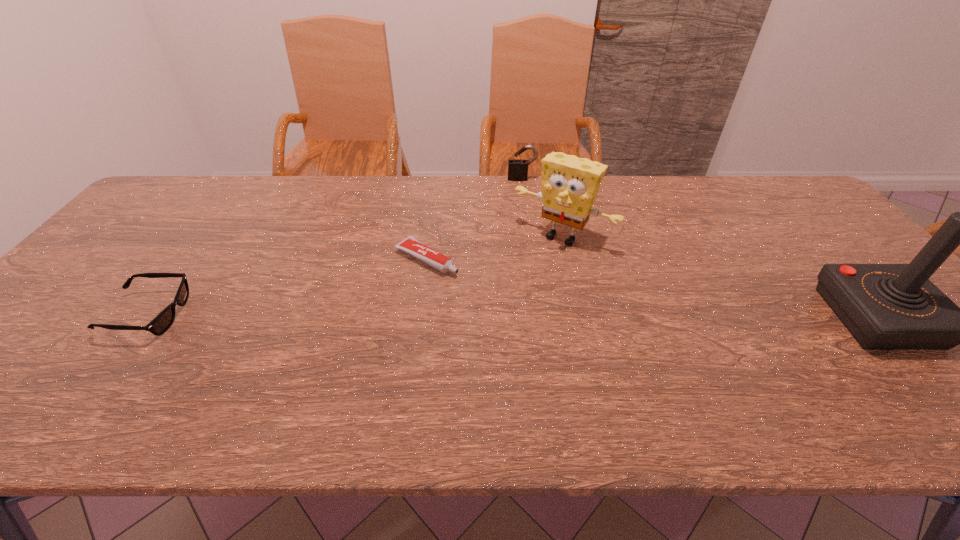
The image size is (960, 540). What are the coordinates of `empty space between the joystick and the fourth shortest object` in the screenshot? It's located at (720, 277).

Where is `unoccupied position between the rightmost object and the toothpaste`? unoccupied position between the rightmost object and the toothpaste is located at coordinates (653, 288).

The height and width of the screenshot is (540, 960). In order to click on free spot between the second shortest object and the fourth object from right to left in this screenshot , I will do `click(288, 287)`.

This screenshot has height=540, width=960. I want to click on vacant area between the sponge and the fourth tallest object, so click(x=355, y=276).

Identify the location of empty space that is in between the sunglasses and the shortest object. Image resolution: width=960 pixels, height=540 pixels. (288, 287).

Locate an element on the screen. free space between the rightmost object and the fourth tallest object is located at coordinates (514, 316).

Identify the location of free space between the joystick and the fourth shortest object. The image size is (960, 540). pos(720,277).

Identify the location of free space that is in between the fourth shortest object and the toothpaste. (494, 248).

This screenshot has width=960, height=540. What are the coordinates of `object that is the third closest to the fourth object from right to left` in the screenshot? It's located at (162, 322).

Point out which object is positioned as the nearest to the padlock. Please provide its 2D coordinates. Your answer should be formatted as a tuple, i.e. [(x, y)], where the tuple contains the x and y coordinates of a point satisfying the conditions above.

[(570, 184)]